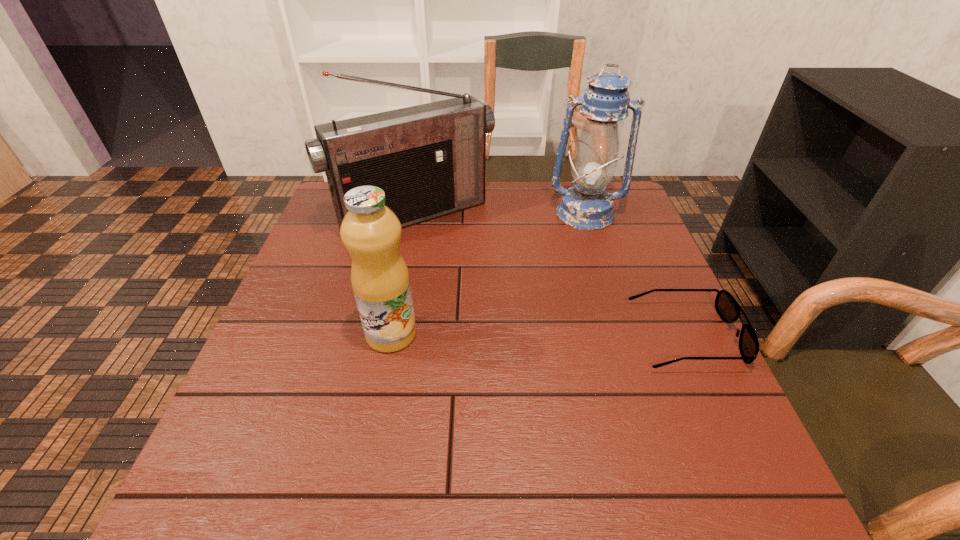
The width and height of the screenshot is (960, 540). Identify the location of free space between the lantern and the spectacles. (636, 275).

The height and width of the screenshot is (540, 960). Find the location of `vacant region between the radio receiver and the shortest object`. vacant region between the radio receiver and the shortest object is located at coordinates (550, 275).

At what (x,y) coordinates should I click in order to perform the action: click on the closest object relative to the lantern. Please return your answer as a coordinate pair (x, y). Looking at the image, I should click on (430, 160).

Locate which object ranks third in proximity to the lantern. Please provide its 2D coordinates. Your answer should be formatted as a tuple, i.e. [(x, y)], where the tuple contains the x and y coordinates of a point satisfying the conditions above.

[(371, 232)]

Find the location of a particular element. The image size is (960, 540). free spot that satisfies the following two spatial constraints: 1. on the front side of the lantern; 2. on the front-facing side of the shortest object is located at coordinates (623, 336).